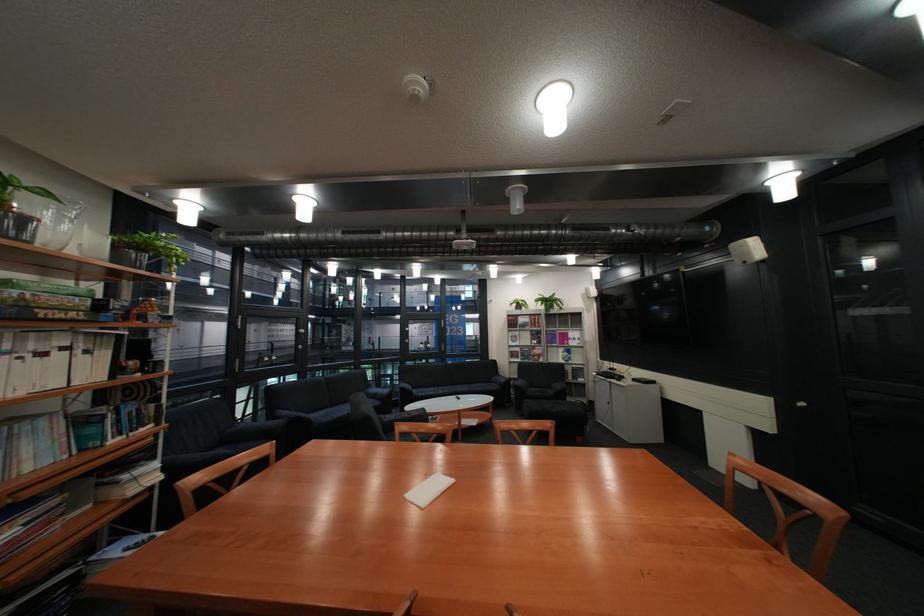
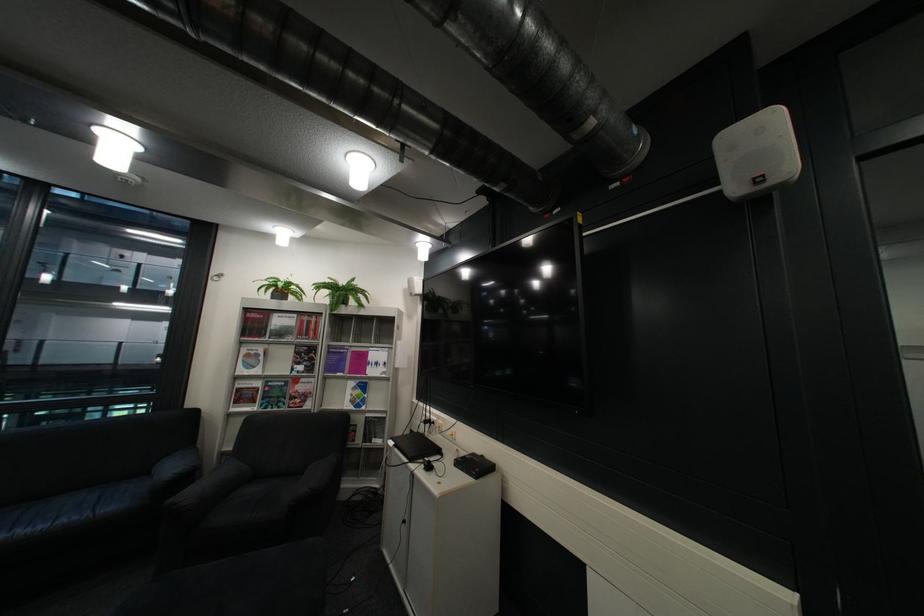
Where in the second image is the point corresponding to [524,320] from the first image?

(260, 320)